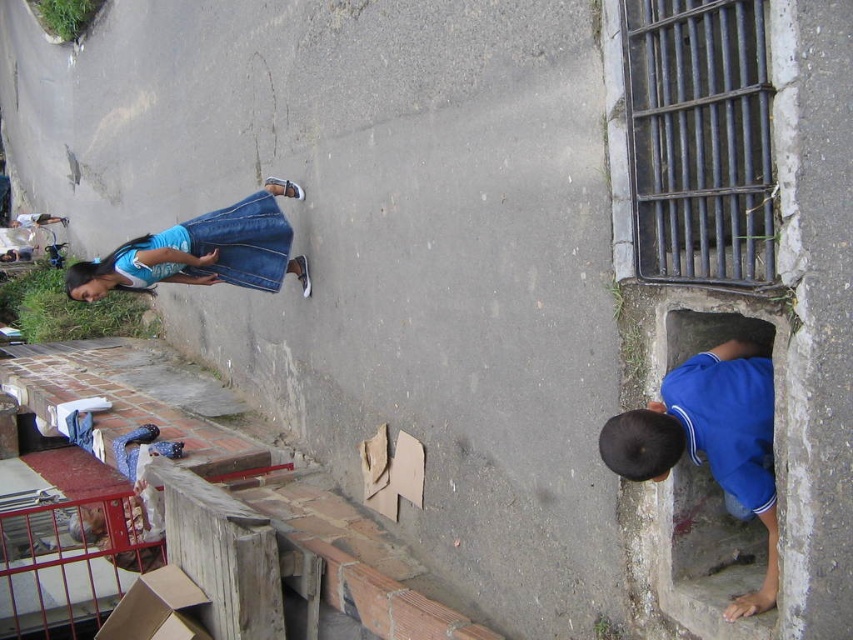
You are a delivery drone trying to deliver a package to the blue matte shirt at lower right. The delivery zone is a circle with a radius of 0.1 centered at point 0.7, 0.8. Will the drone be able to deliver the package?

The blue matte shirt at lower right is located at point [711,440]. The distance from this point to the center of the delivery zone at [682,448] is sqrt of squared differences in x and y coordinates. Calculating sqrt of squared difference in x is 0.011 squared, which is 0.000121, and squared difference in y is 0.034 squared, which is 0.001156. Adding them gives 0.001277, square root is approximately 0.0357. Since 0.0357 is less than 0.1, the distance is within the radius. Therefore, the drone can deliver.

You are a pedestrian standing on the street and see the blue matte shirt at lower right and the denim skirt at upper left. Which object is positioned lower in the image?

The blue matte shirt at lower right is positioned below the denim skirt at upper left, so it is lower in the image.

You are a pedestrian standing on the street and see the blue matte shirt at lower right and the denim skirt at upper left. Which person is closer to the street edge?

The blue matte shirt at lower right is positioned on the right side of denim skirt at upper left, so the blue matte shirt at lower right is closer to the street edge on the right side.